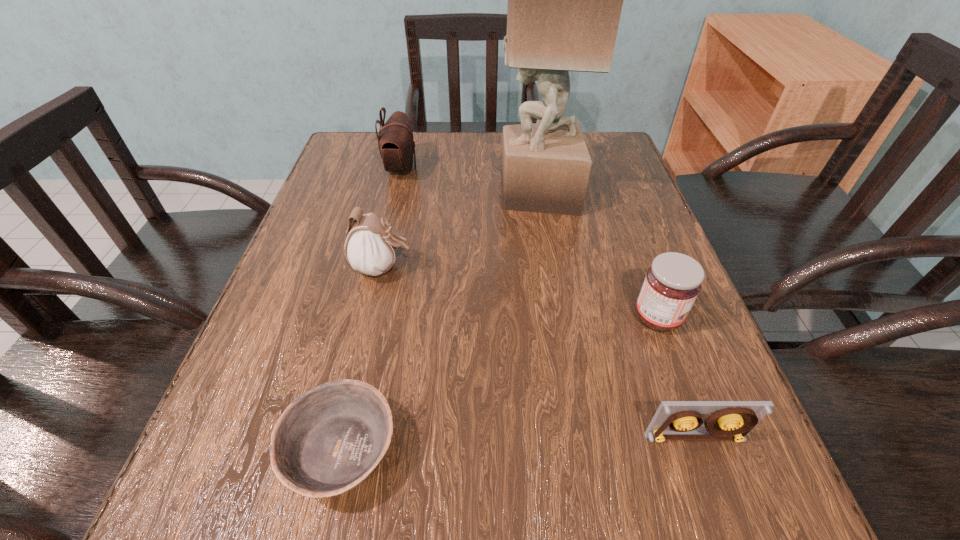
I want to click on free space that satisfies the following two spatial constraints: 1. on the front-facing side of the third nearest object; 2. on the left side of the nearer pouch, so click(372, 318).